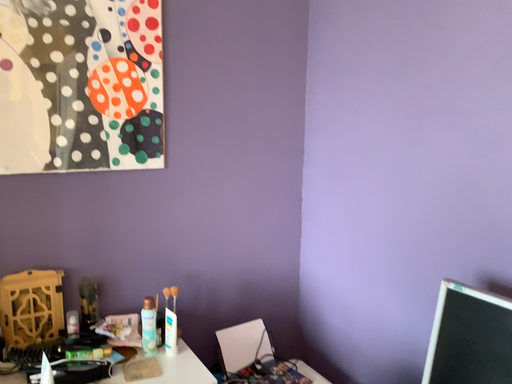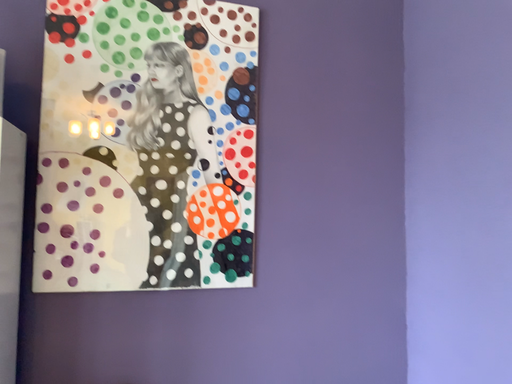
Question: Which way did the camera rotate in the video?

Choices:
 (A) rotated right
 (B) rotated left

Answer: (B)